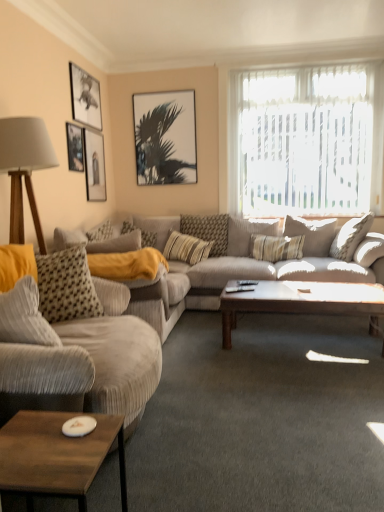
Question: From a real-world perspective, is translucent fabric at upper right positioned above or below striped fabric pillow at center, arranged as the 3th pillow when viewed from the right?

Choices:
 (A) above
 (B) below

Answer: (A)

Question: From the image's perspective, is translucent fabric at upper right positioned above or below striped fabric pillow at center, positioned as the third pillow in left-to-right order?

Choices:
 (A) above
 (B) below

Answer: (A)

Question: Estimate the real-world distances between objects in this image. Which object is farther from the velvet gray couch at left, the second studio couch when ordered from back to front?

Choices:
 (A) matte black picture frame at upper left, arranged as the second picture frame when viewed from the left
 (B) yellow corduroy pillow at center, which is the first pillow in left-to-right order
 (C) wooden rectangular table at lower left, the 2th coffee table in the right-to-left sequence
 (D) striped fabric pillow at center, which is the 2th pillow in right-to-left order
 (E) striped fabric pillow at center, which ranks as the fourth pillow in right-to-left order

Answer: (A)

Question: Estimate the real-world distances between objects in this image. Which object is closer to the striped fabric pillow at center, which ranks as the fourth pillow in right-to-left order?

Choices:
 (A) wooden tripod lamp at left
 (B) wooden rectangular table at lower left, which appears as the second coffee table when viewed from the back
 (C) matte black picture frame at upper left, which appears as the 3th picture frame when viewed from the right
 (D) translucent fabric at upper right
 (E) velvet gray couch at left, the second studio couch when ordered from back to front

Answer: (D)